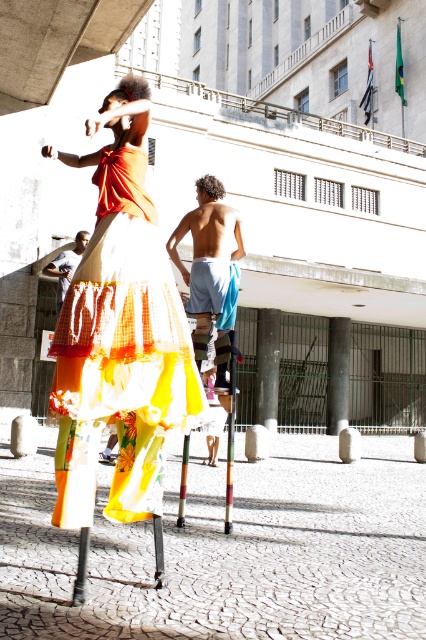
Question: Which of the following is the closest to the observer?

Choices:
 (A) (230, 422)
 (B) (206, 253)

Answer: (A)

Question: Considering the relative positions of floral chiffon dress at center and matte blue shorts at lower left in the image provided, where is floral chiffon dress at center located with respect to matte blue shorts at lower left?

Choices:
 (A) below
 (B) above

Answer: (A)

Question: Which object appears closest to the camera in this image?

Choices:
 (A) floral chiffon dress at center
 (B) matte blue shorts at lower left
 (C) light blue fabric shorts at center
 (D) wooden pole at center

Answer: (A)

Question: Which object appears farthest from the camera in this image?

Choices:
 (A) light blue fabric shorts at center
 (B) wooden pole at center
 (C) matte blue shorts at lower left
 (D) floral chiffon dress at center

Answer: (C)

Question: Is light blue fabric shorts at center closer to camera compared to wooden pole at center?

Choices:
 (A) no
 (B) yes

Answer: (A)

Question: Considering the relative positions of wooden pole at center and matte blue shorts at lower left in the image provided, where is wooden pole at center located with respect to matte blue shorts at lower left?

Choices:
 (A) above
 (B) below

Answer: (B)